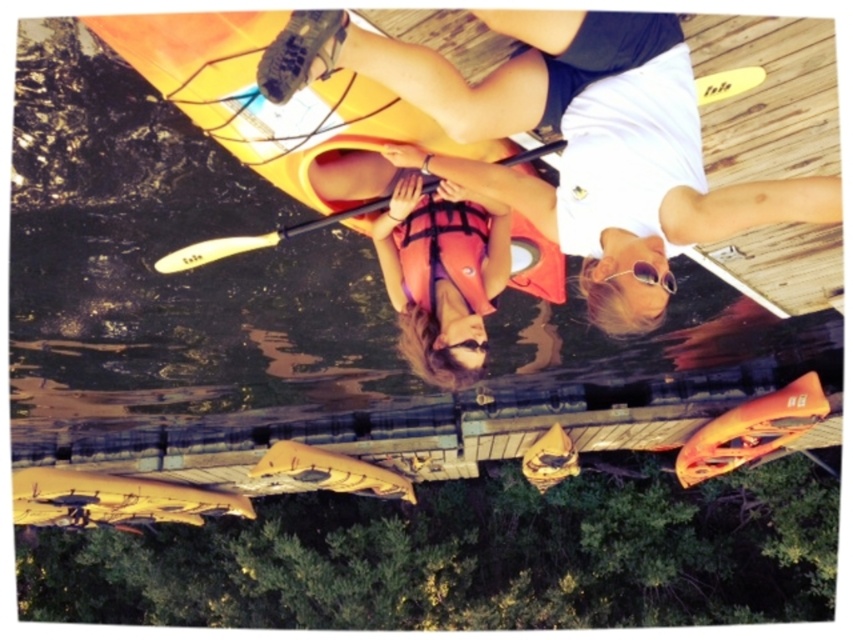
You are planning to store the matte orange kayak at upper center and the orange mesh life jacket at center in a vertical storage rack. Which item will require more vertical space?

The matte orange kayak at upper center requires more vertical space because it has a greater height compared to the orange mesh life jacket at center.

You are navigating a kayak on the water and want to reach a destination located at point [764,74]. There is an obstacle at point [398,211]. Based on the scene description, can you safely navigate around the obstacle to reach your destination?

Point [398,211] is behind point [764,74], so the obstacle is located behind your destination. This means you can safely navigate towards the destination without encountering the obstacle in your path.

You are a photographer trying to capture a clear shot of both the orange life vest at center and the wooden smooth paddle at center. Since the image is rotated, you need to adjust your focus. Which object should you focus on first to ensure it appears larger in your photo?

The orange life vest at center is larger in size than the wooden smooth paddle at center, so you should focus on the orange life vest at center first to ensure it appears larger in your photo.